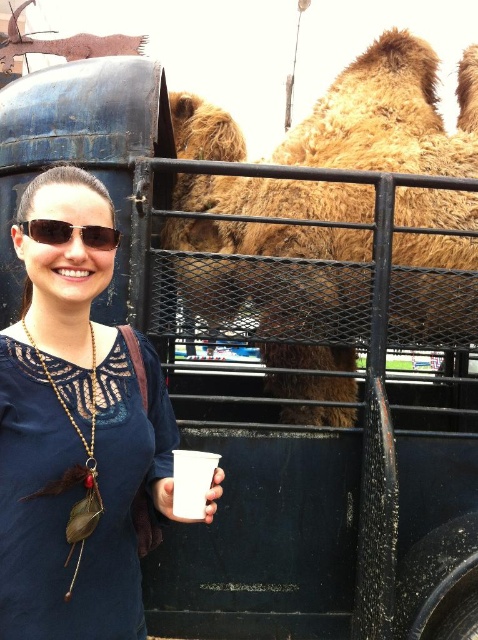
Question: Among these objects, which one is farthest from the camera?

Choices:
 (A) white paper cup at lower left
 (B) matte black sunglasses at center
 (C) fuzzy brown camel at upper right

Answer: (C)

Question: Where is white paper cup at lower left located in relation to matte black sunglasses at center in the image?

Choices:
 (A) above
 (B) below

Answer: (B)

Question: Is blue fabric shirt at center closer to the viewer compared to matte black sunglasses at center?

Choices:
 (A) no
 (B) yes

Answer: (B)

Question: Which point appears farthest from the camera in this image?

Choices:
 (A) (41, 221)
 (B) (201, 502)
 (C) (436, 298)

Answer: (C)

Question: Is fuzzy brown camel at upper right thinner than blue fabric shirt at center?

Choices:
 (A) no
 (B) yes

Answer: (A)

Question: Which point is closer to the camera?

Choices:
 (A) fuzzy brown camel at upper right
 (B) blue fabric shirt at center
 (C) matte black sunglasses at center

Answer: (B)